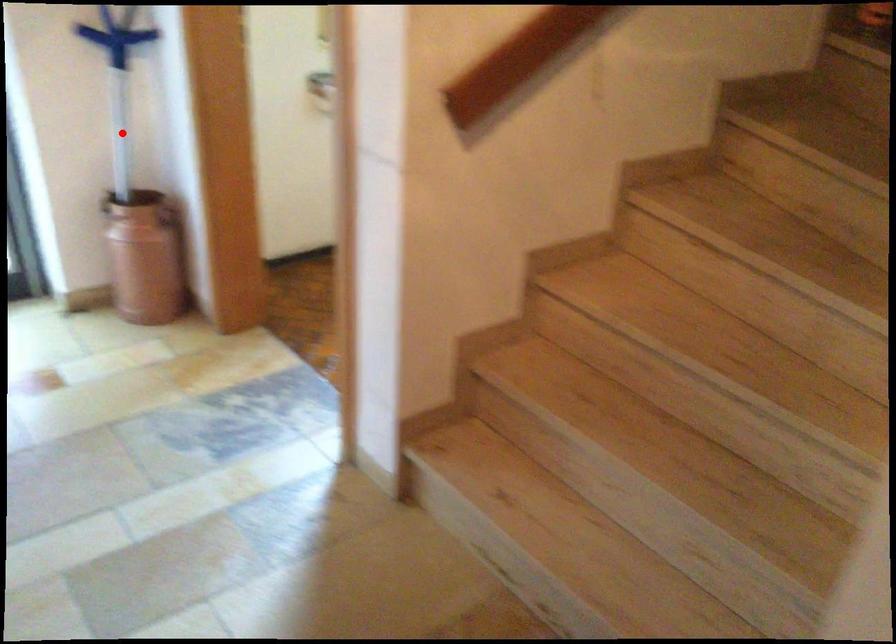
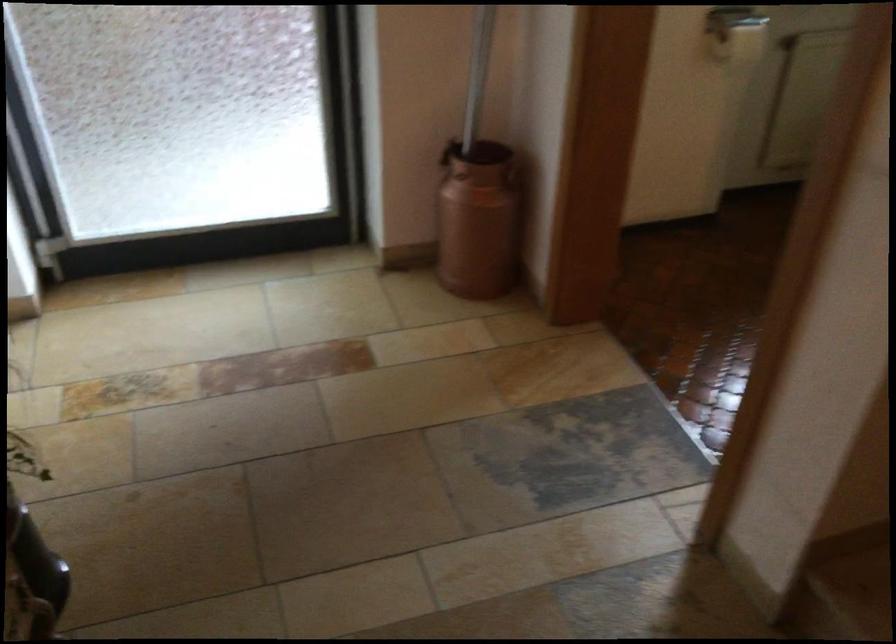
The point at the highlighted location is marked in the first image. Where is the corresponding point in the second image?

(478, 73)